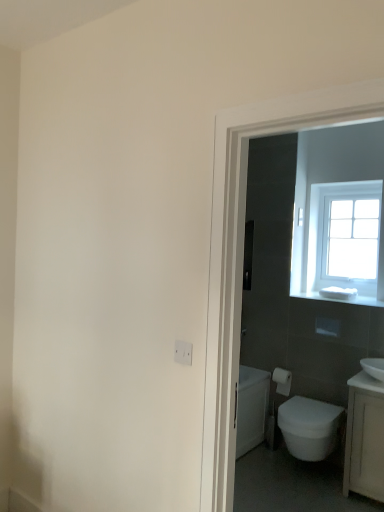
Identify the location of vacant space situated above white glossy bidet at lower right (from a real-world perspective). (309, 409).